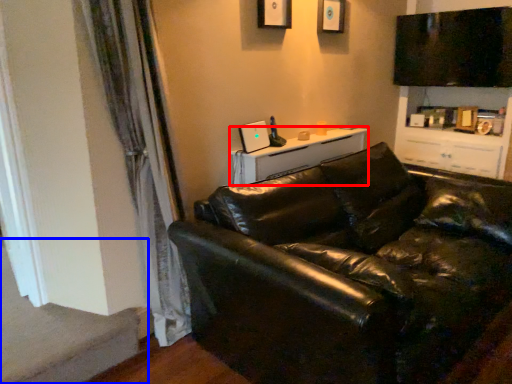
Question: Which point is closer to the camera, table (highlighted by a red box) or stairwell (highlighted by a blue box)?

Choices:
 (A) table
 (B) stairwell

Answer: (B)